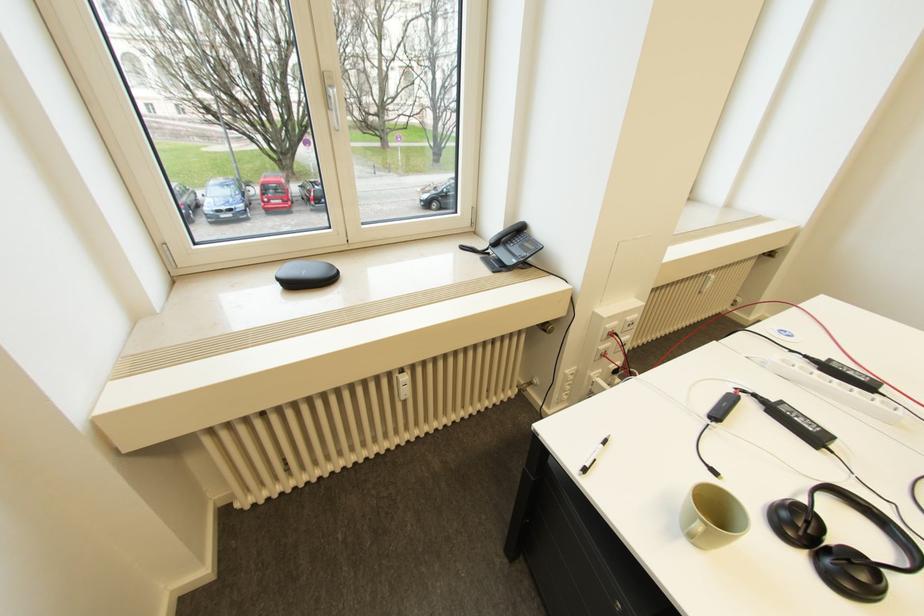
This screenshot has height=616, width=924. Describe the element at coordinates (592, 456) in the screenshot. I see `the white marker` at that location.